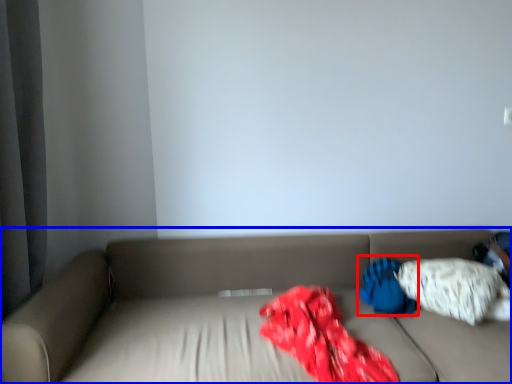
Question: Which object appears closest to the camera in this image, pillow (highlighted by a red box) or studio couch (highlighted by a blue box)?

Choices:
 (A) pillow
 (B) studio couch

Answer: (B)